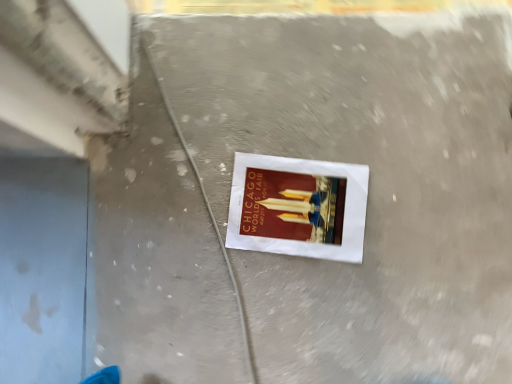
I want to click on vacant area located to the right-hand side of white paper poster at center, so click(412, 216).